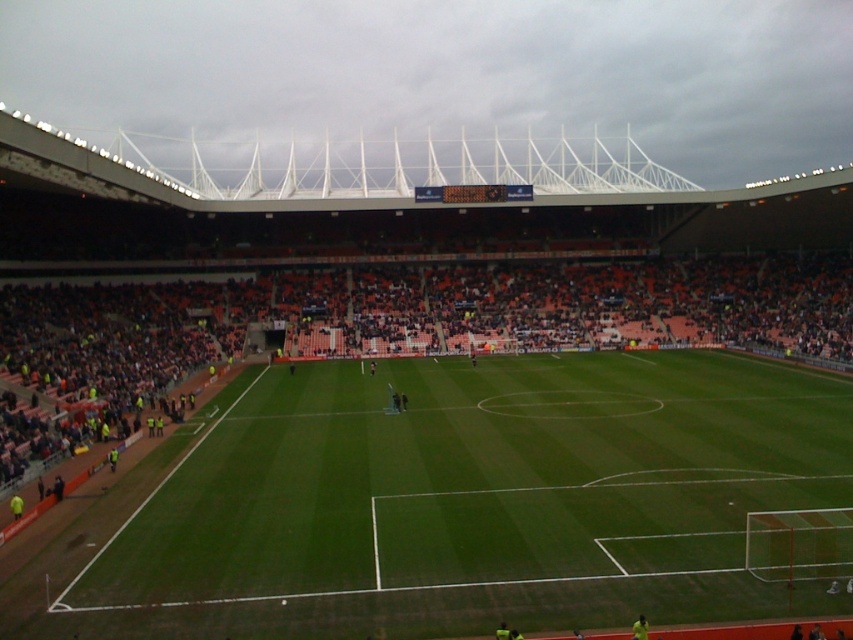
Is green grass football field at center smaller than orange plastic seats at center?

Indeed, green grass football field at center has a smaller size compared to orange plastic seats at center.

Is green grass football field at center to the left of orange plastic seats at center from the viewer's perspective?

Correct, you'll find green grass football field at center to the left of orange plastic seats at center.

Image resolution: width=853 pixels, height=640 pixels. What do you see at coordinates (483, 497) in the screenshot? I see `green grass football field at center` at bounding box center [483, 497].

The image size is (853, 640). What are the coordinates of `green grass football field at center` in the screenshot? It's located at (483, 497).